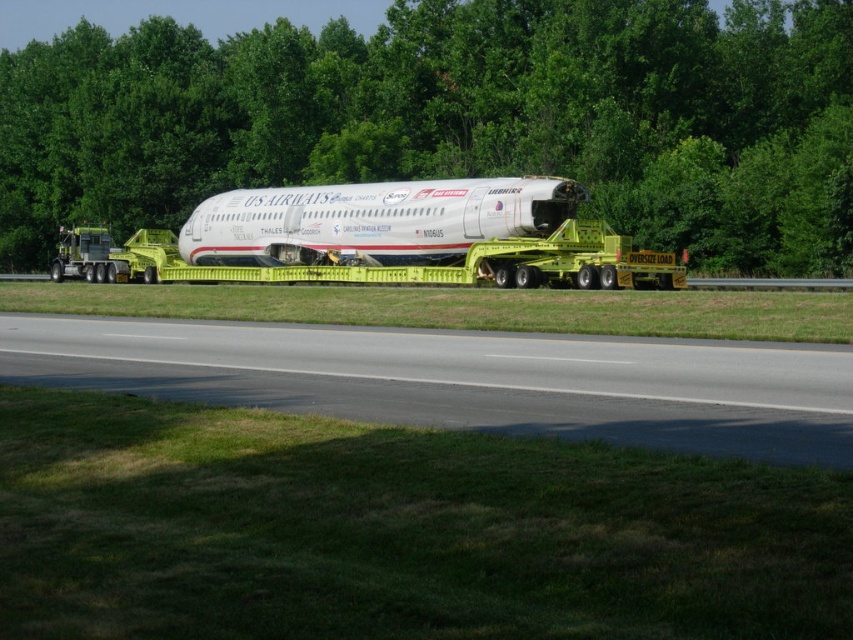
Question: Where is white matte airplane at center located in relation to yellow metallic tow truck at center in the image?

Choices:
 (A) left
 (B) right

Answer: (B)

Question: Can you confirm if green leafy tree at center is wider than yellow metallic tow truck at center?

Choices:
 (A) no
 (B) yes

Answer: (B)

Question: Which point appears farthest from the camera in this image?

Choices:
 (A) (553, 244)
 (B) (268, 250)

Answer: (B)

Question: Does white matte airplane at center have a smaller size compared to yellow metallic tow truck at center?

Choices:
 (A) yes
 (B) no

Answer: (A)

Question: Which point is closer to the camera?

Choices:
 (A) (520, 339)
 (B) (416, 16)
 (C) (103, 262)
 (D) (202, 243)

Answer: (A)

Question: Which point is closer to the camera taking this photo?

Choices:
 (A) (202, 246)
 (B) (502, 108)
 (C) (496, 419)
 (D) (642, 257)

Answer: (C)